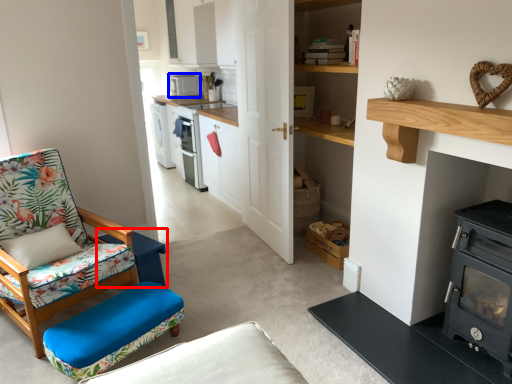
Question: Which object appears closest to the camera in this image, table (highlighted by a red box) or appliance (highlighted by a blue box)?

Choices:
 (A) table
 (B) appliance

Answer: (A)